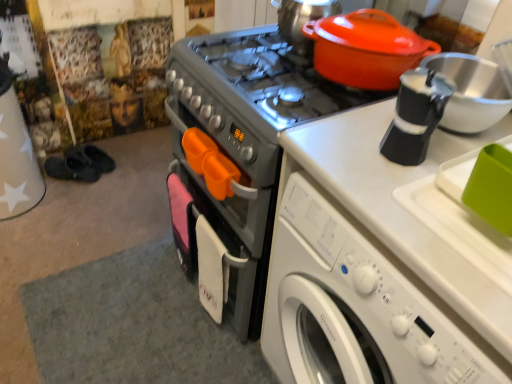
Question: Is the position of matte orange tea pot at upper right more distant than that of matte orange pot at upper right?

Choices:
 (A) yes
 (B) no

Answer: (A)

Question: From a real-world perspective, does matte orange tea pot at upper right sit lower than matte orange pot at upper right?

Choices:
 (A) yes
 (B) no

Answer: (A)

Question: Is matte orange tea pot at upper right surrounding matte orange pot at upper right?

Choices:
 (A) no
 (B) yes

Answer: (A)

Question: Considering the relative sizes of matte orange tea pot at upper right and matte orange pot at upper right in the image provided, is matte orange tea pot at upper right thinner than matte orange pot at upper right?

Choices:
 (A) no
 (B) yes

Answer: (A)

Question: Are matte orange tea pot at upper right and matte orange pot at upper right making contact?

Choices:
 (A) yes
 (B) no

Answer: (B)

Question: From the image's perspective, relative to metallic gray stove at center, is matte orange tea pot at upper right above or below?

Choices:
 (A) above
 (B) below

Answer: (A)

Question: In terms of size, does matte orange tea pot at upper right appear bigger or smaller than metallic gray stove at center?

Choices:
 (A) big
 (B) small

Answer: (B)

Question: Visually, is matte orange tea pot at upper right positioned to the left or to the right of metallic gray stove at center?

Choices:
 (A) right
 (B) left

Answer: (A)

Question: In the image, is matte orange tea pot at upper right positioned in front of or behind metallic gray stove at center?

Choices:
 (A) front
 (B) behind

Answer: (B)

Question: Is matte orange pot at upper right spatially inside white plastic washing machine at lower right, or outside of it?

Choices:
 (A) outside
 (B) inside

Answer: (A)

Question: From a real-world perspective, relative to white plastic washing machine at lower right, is matte orange pot at upper right vertically above or below?

Choices:
 (A) above
 (B) below

Answer: (A)

Question: Is matte orange pot at upper right wider or thinner than white plastic washing machine at lower right?

Choices:
 (A) wide
 (B) thin

Answer: (B)

Question: Is point (337, 54) closer or farther from the camera than point (316, 183)?

Choices:
 (A) farther
 (B) closer

Answer: (A)

Question: Is matte orange pot at upper right wider or thinner than metallic gray stove at center?

Choices:
 (A) thin
 (B) wide

Answer: (A)

Question: Would you say matte orange pot at upper right is inside or outside metallic gray stove at center?

Choices:
 (A) inside
 (B) outside

Answer: (B)